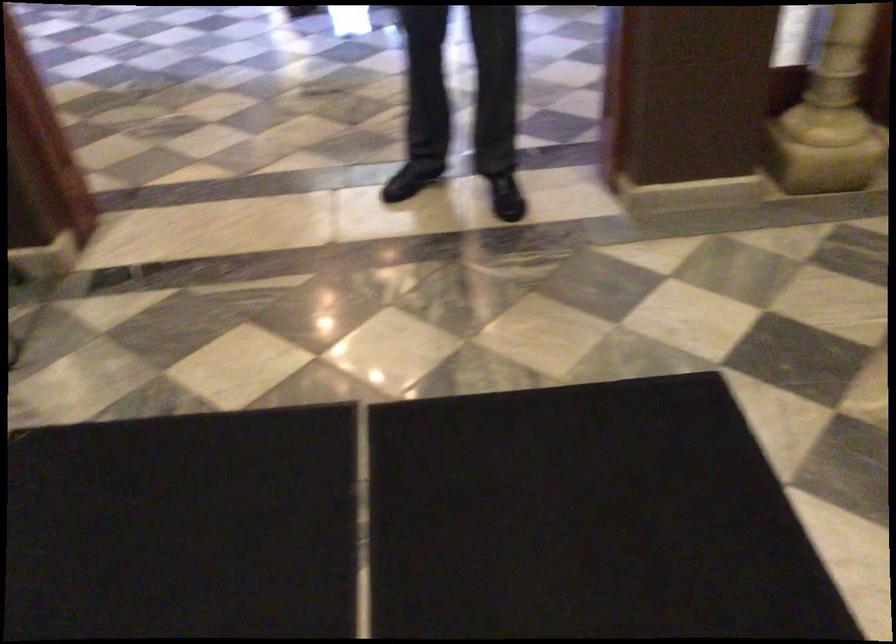
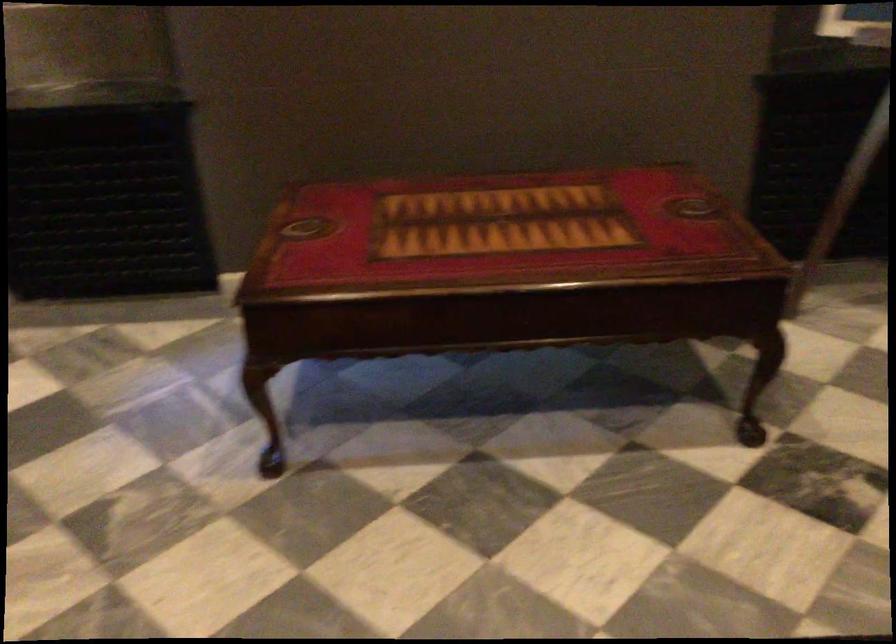
Looking at this image, first-person continuous shooting, in which direction is the camera rotating?

The camera's rotation is toward left-down.